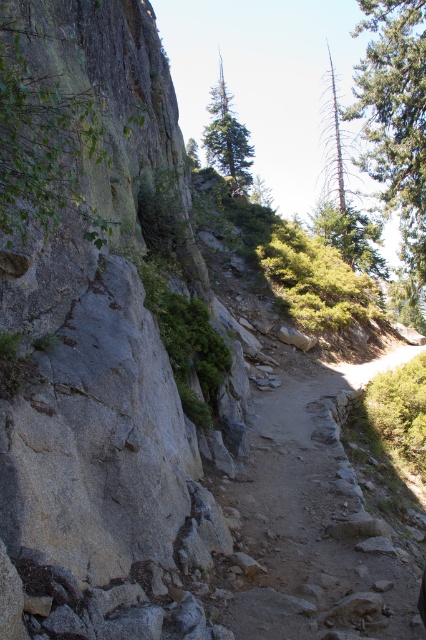
Does dirt path at center appear over green textured pine at upper center?

Incorrect, dirt path at center is not positioned above green textured pine at upper center.

Between dirt path at center and green textured pine at upper center, which one has more height?

Standing taller between the two is green textured pine at upper center.

What do you see at coordinates (317, 518) in the screenshot?
I see `dirt path at center` at bounding box center [317, 518].

Identify the location of dirt path at center. The height and width of the screenshot is (640, 426). (317, 518).